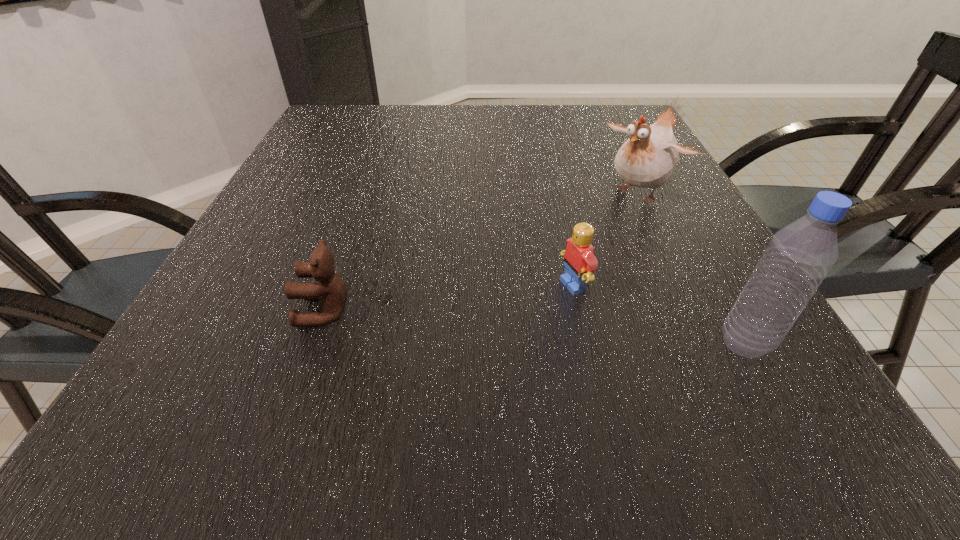
Identify the location of vacant space at the far edge. The height and width of the screenshot is (540, 960). (534, 109).

Locate an element on the screen. This screenshot has height=540, width=960. free space at the left edge of the desktop is located at coordinates (295, 306).

The height and width of the screenshot is (540, 960). In the image, there is a desktop. In order to click on vacant space at the right edge in this screenshot , I will do `click(686, 320)`.

In the image, there is a desktop. At what (x,y) coordinates should I click in order to perform the action: click on vacant space at the far left corner. Please return your answer as a coordinate pair (x, y). Image resolution: width=960 pixels, height=540 pixels. Looking at the image, I should click on (344, 119).

Where is `free space at the near left corner of the desktop`? The height and width of the screenshot is (540, 960). free space at the near left corner of the desktop is located at coordinates (190, 363).

In the image, there is a desktop. Find the location of `free space at the far right corner`. free space at the far right corner is located at coordinates (609, 109).

Locate an element on the screen. The height and width of the screenshot is (540, 960). free location at the near right corner of the desktop is located at coordinates (763, 360).

In order to click on blank region between the second tallest object and the leftmost object in this screenshot , I will do `click(482, 252)`.

I want to click on vacant point located between the leftmost object and the Lego, so click(449, 298).

Identify the location of vacant region between the leftmost object and the third shortest object. (482, 252).